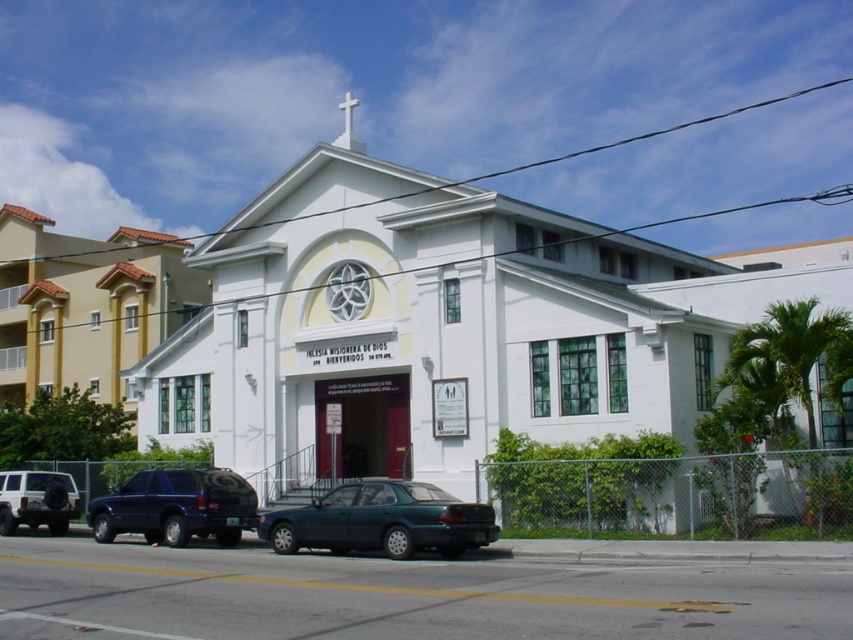
You are a photographer wanting to capture both the beige stucco church at center and the teal glossy sedan at center in a single shot. Based on their positions, which object should you place closer to the left side of your camera frame?

The beige stucco church at center is positioned on the left side of teal glossy sedan at center, so to include both in the frame, you should place the beige stucco church at center closer to the left side of your camera frame.